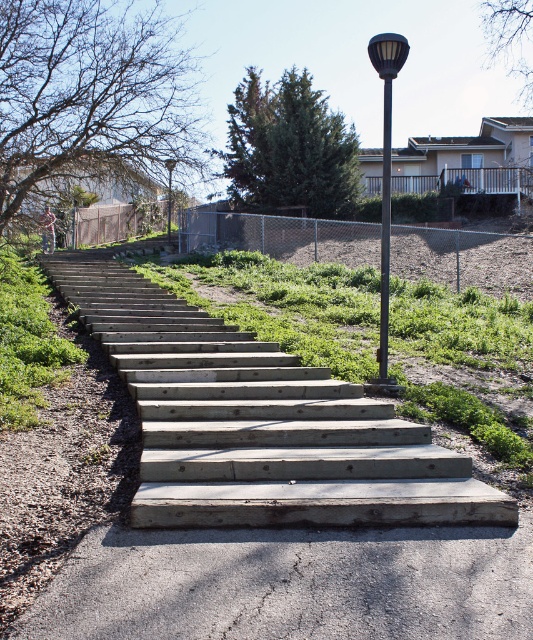
Question: Where is green leafy grass at left located in relation to black metal pole at upper center in the image?

Choices:
 (A) below
 (B) above

Answer: (A)

Question: Which of the following is the farthest from the observer?

Choices:
 (A) (387, 173)
 (B) (390, 612)
 (C) (52, 330)
 (D) (383, 212)

Answer: (A)

Question: Is green leafy grass at left bigger than black metal pole at upper center?

Choices:
 (A) no
 (B) yes

Answer: (A)

Question: Is green leafy grass at left to the left of black metal pole at upper center from the viewer's perspective?

Choices:
 (A) no
 (B) yes

Answer: (B)

Question: Which object appears closest to the camera in this image?

Choices:
 (A) metallic pole at center
 (B) wooden stairs at center
 (C) black metal pole at upper center

Answer: (B)

Question: Based on their relative distances, which object is farther from the black metal pole at upper center?

Choices:
 (A) gray concrete pavement at lower center
 (B) wooden stairs at center

Answer: (A)